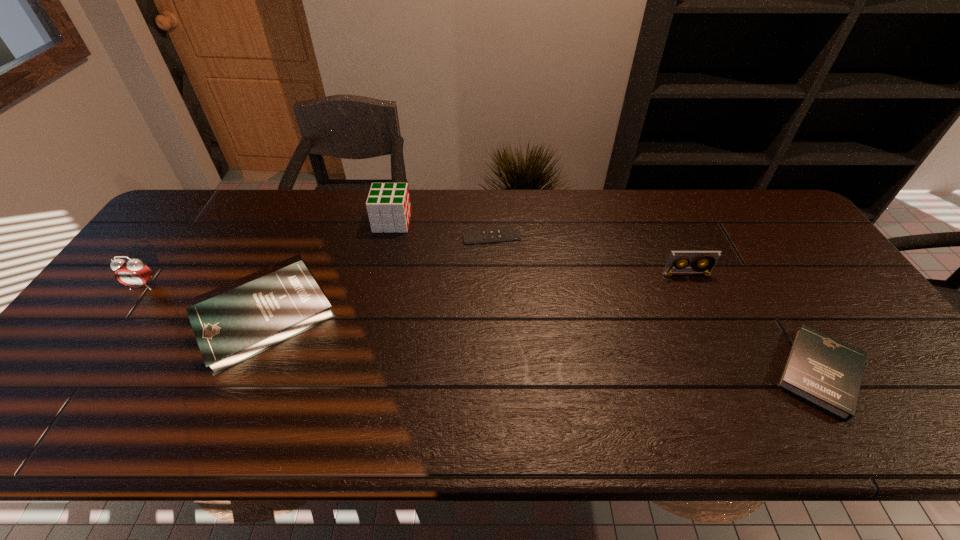
I want to click on the third shortest object, so click(231, 327).

Identify the location of the left book. (231, 327).

Locate an element on the screen. the shorter book is located at coordinates (826, 372).

This screenshot has height=540, width=960. Find the location of `the second shortest object`. the second shortest object is located at coordinates (826, 372).

Locate an element on the screen. remote control is located at coordinates (513, 233).

Locate an element on the screen. The width and height of the screenshot is (960, 540). the shortest object is located at coordinates (513, 233).

Find the location of a particular element. The width and height of the screenshot is (960, 540). the third object from left to right is located at coordinates (388, 205).

Identify the location of alarm clock. (132, 273).

At what (x,y) coordinates should I click in order to perform the action: click on videotape. Please return your answer as a coordinate pair (x, y). Image resolution: width=960 pixels, height=540 pixels. Looking at the image, I should click on (709, 259).

What are the coordinates of `the fourth shortest object` in the screenshot? It's located at (709, 259).